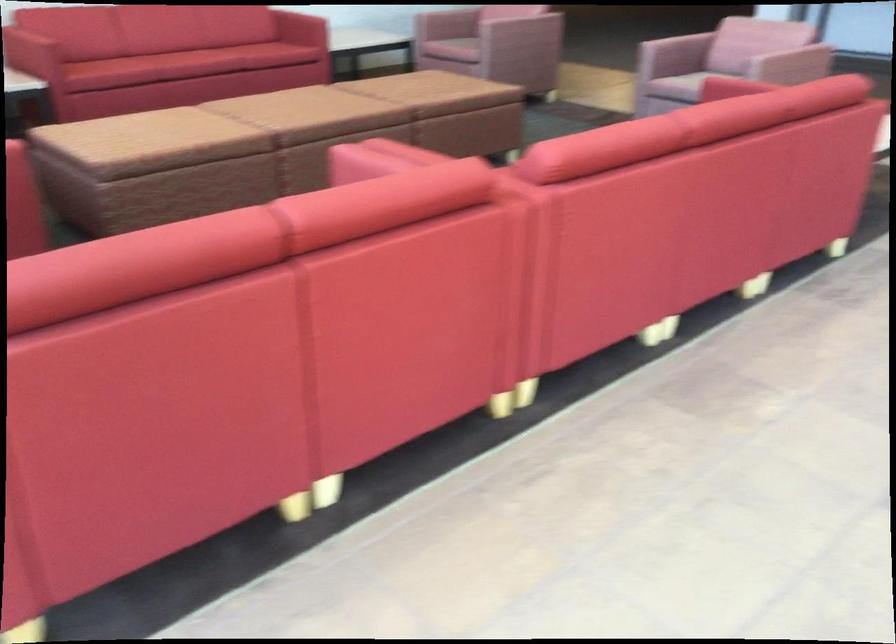
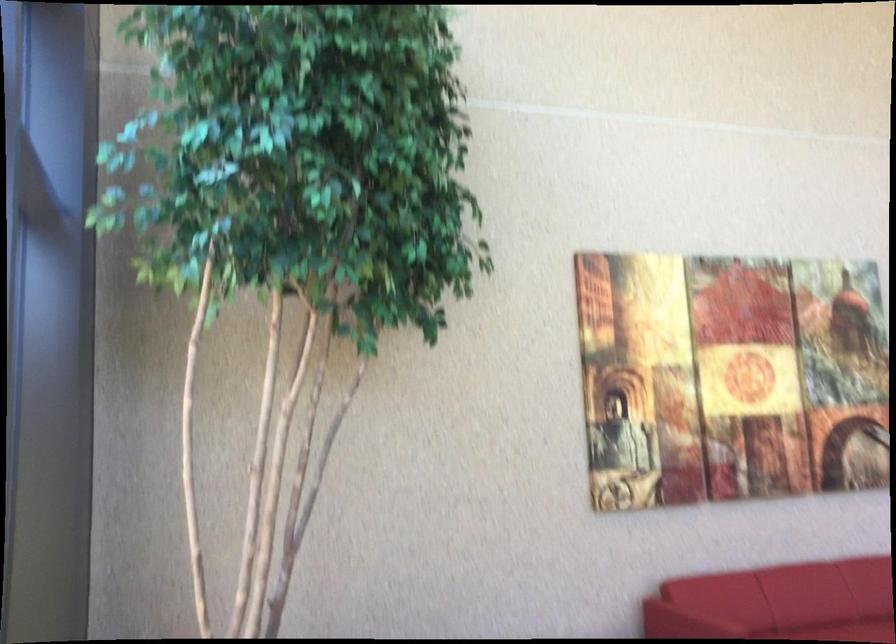
Question: Which direction would the cameraman need to move to produce the second image? Reply with the corresponding letter.

Choices:
 (A) Left
 (B) Right
 (C) Forward
 (D) Backward

Answer: (D)